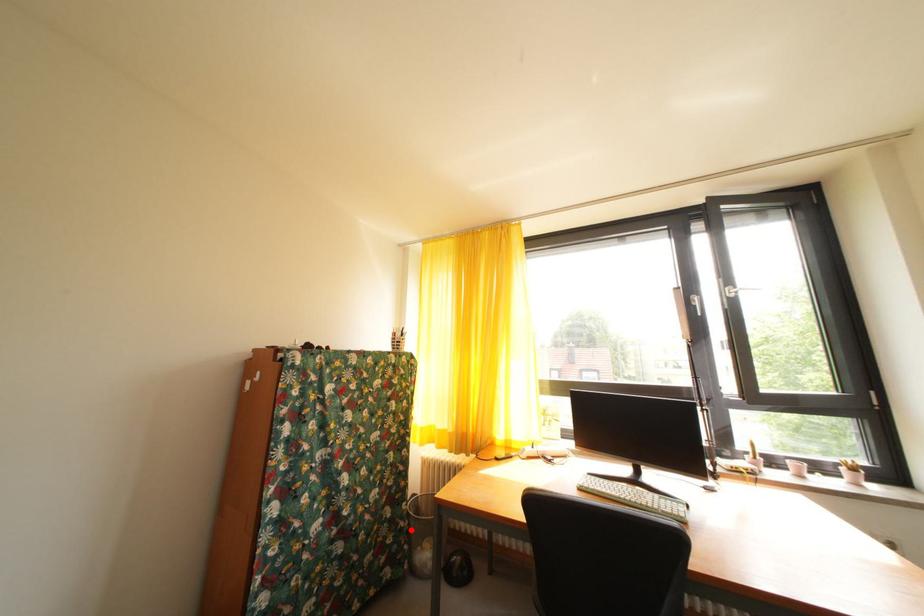
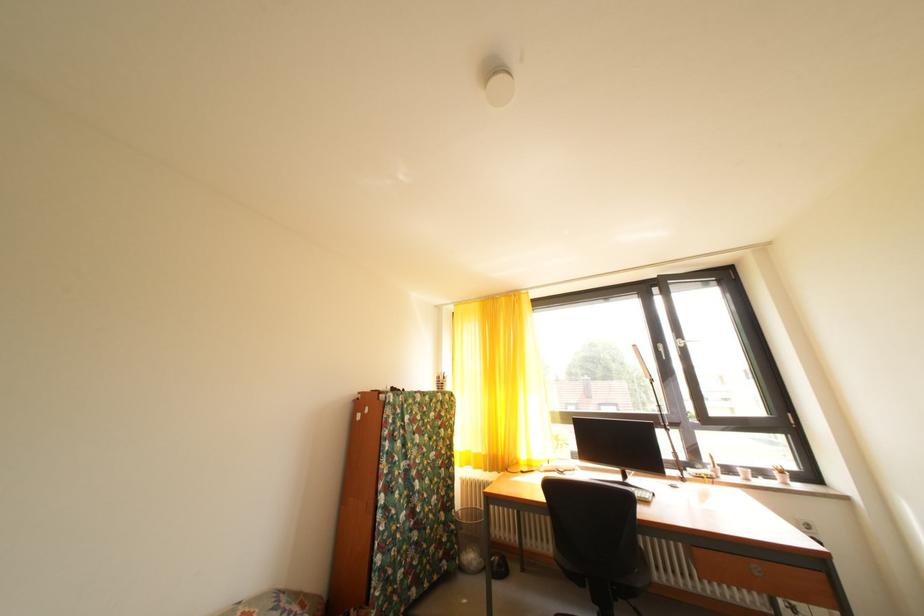
Locate, in the second image, the point that corresponds to the highlighted location in the first image.

(462, 533)